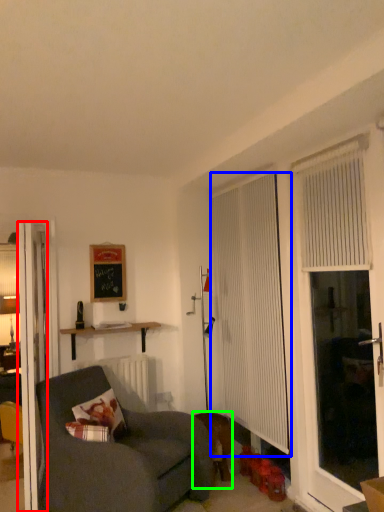
Question: Which is farther away from door (highlighted by a red box)? curtain (highlighted by a blue box) or animal (highlighted by a green box)?

Choices:
 (A) curtain
 (B) animal

Answer: (A)